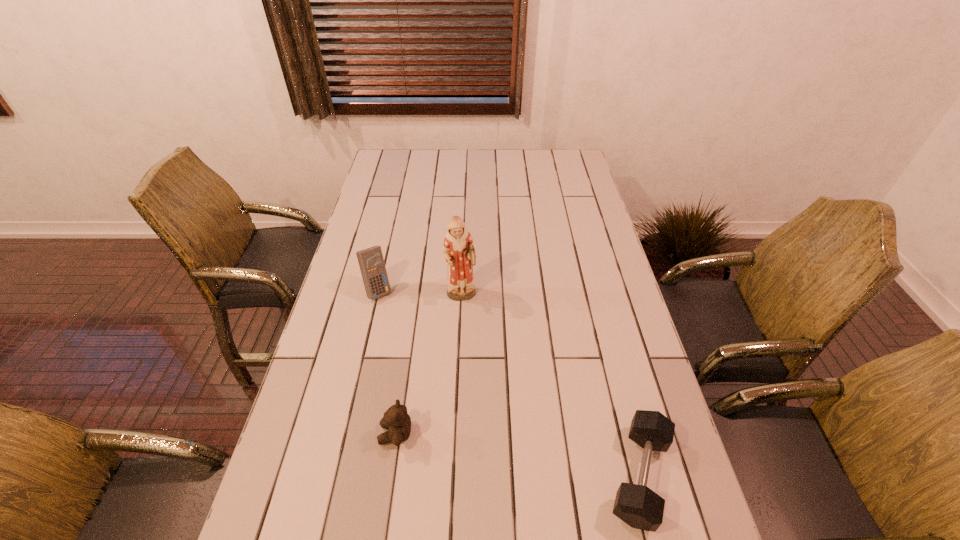
At what (x,y) coordinates should I click in order to perform the action: click on free space located on the face of the second shortest object. Please return your answer as a coordinate pair (x, y). This screenshot has width=960, height=540. Looking at the image, I should click on (307, 434).

At what (x,y) coordinates should I click in order to perform the action: click on free space located 0.310m on the back of the dumbbell. Please return your answer as a coordinate pair (x, y). The image size is (960, 540). Looking at the image, I should click on (601, 326).

At what (x,y) coordinates should I click in order to perform the action: click on vacant region located on the front-facing side of the third object from left to right. Please return your answer as a coordinate pair (x, y). Looking at the image, I should click on (490, 381).

The width and height of the screenshot is (960, 540). Identify the location of vacant space located on the front-facing side of the third object from left to right. (480, 350).

Image resolution: width=960 pixels, height=540 pixels. In order to click on vacant region located on the front-facing side of the third object from left to right in this screenshot , I will do `click(493, 391)`.

The height and width of the screenshot is (540, 960). I want to click on free space located 0.220m on the front-facing side of the calculator, so click(420, 349).

This screenshot has width=960, height=540. Identify the location of free location located 0.120m on the front-facing side of the calculator. (402, 326).

Where is `blank space located on the front-facing side of the calculator`? blank space located on the front-facing side of the calculator is located at coordinates (408, 333).

Locate an element on the screen. object that is at the near edge is located at coordinates (638, 506).

I want to click on object positioned at the left edge, so click(371, 262).